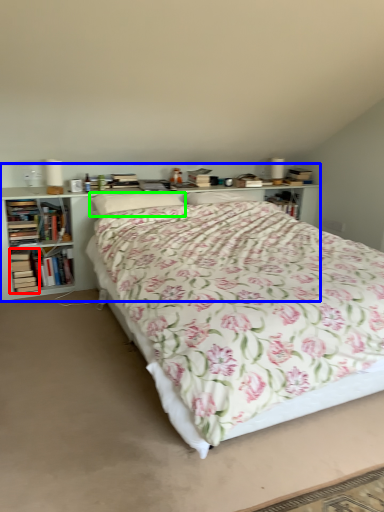
Question: Which object is the farthest from book (highlighted by a red box)? Choose among these: bookcase (highlighted by a blue box) or pillow (highlighted by a green box).

Choices:
 (A) bookcase
 (B) pillow

Answer: (B)